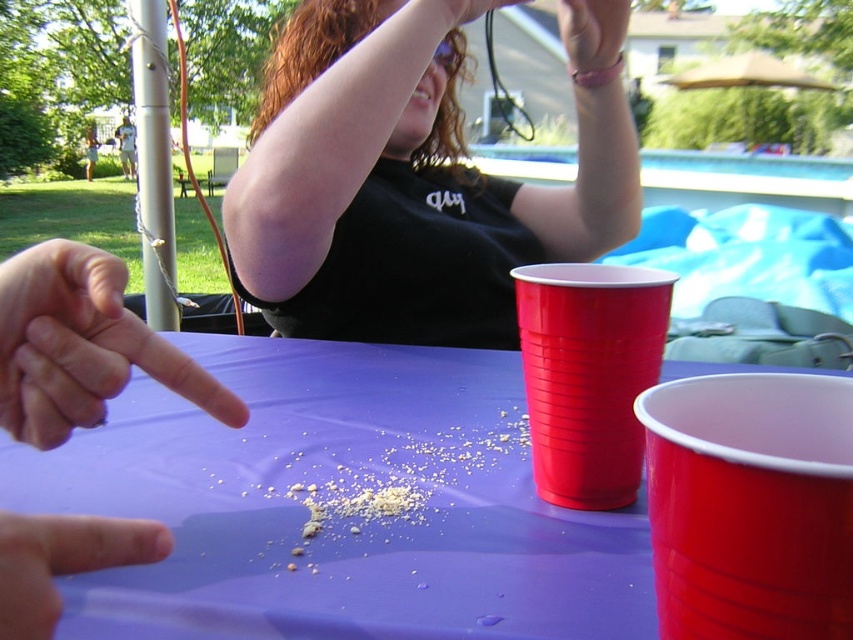
Is purple plastic table at center below matte plastic cup at right?

Yes, purple plastic table at center is below matte plastic cup at right.

Between purple plastic table at center and matte plastic cup at right, which one is positioned lower?

Positioned lower is purple plastic table at center.

Between point (648, 589) and point (833, 632), which one is positioned behind?

Positioned behind is point (648, 589).

What are the coordinates of `purple plastic table at center` in the screenshot? It's located at (337, 506).

Does flesh-toned skin finger at lower left have a larger size compared to matte black hand at upper center?

No.

Does flesh-toned skin finger at lower left have a greater width compared to matte black hand at upper center?

In fact, flesh-toned skin finger at lower left might be narrower than matte black hand at upper center.

Is point (61, 561) positioned after point (469, 12)?

That is False.

The height and width of the screenshot is (640, 853). Find the location of `flesh-toned skin finger at lower left`. flesh-toned skin finger at lower left is located at coordinates (62, 561).

Can you confirm if pink flesh-toned finger at center-left is taller than matte black hand at upper center?

Yes.

Between point (68, 413) and point (477, 12), which one is positioned behind?

The point (477, 12) is more distant.

Describe the element at coordinates (82, 346) in the screenshot. I see `pink flesh-toned finger at center-left` at that location.

This screenshot has height=640, width=853. I want to click on pink flesh-toned finger at center-left, so click(82, 346).